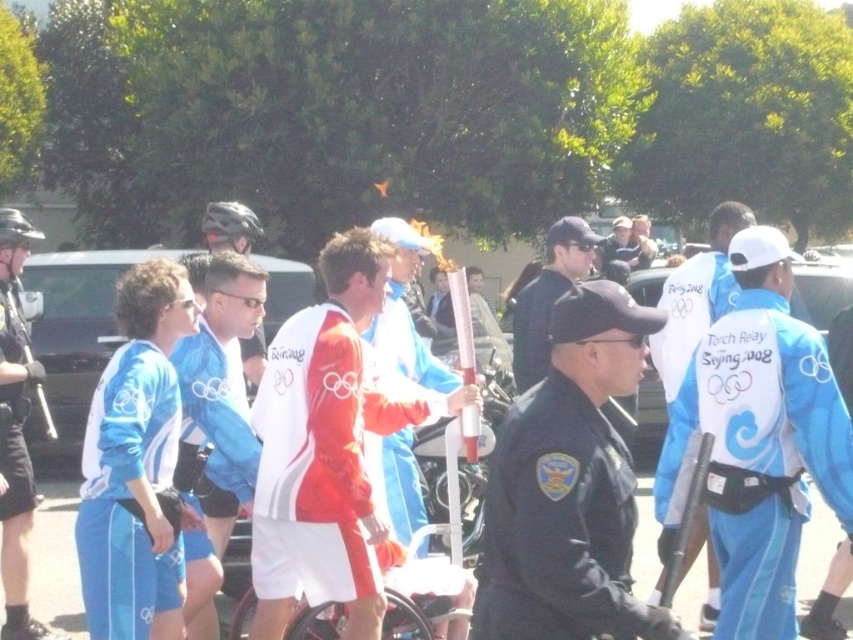
You are a photographer at the Olympic torch relay event. You need to capture a photo of both the blue fabric jacket at center and the dark blue uniform at center. Based on their positions, which one is located to the left side?

The blue fabric jacket at center is positioned on the left side of dark blue uniform at center, so the blue fabric jacket at center is located to the left side.

You are a photographer positioned at the center of the scene. You want to capture a photo that includes both the blue fabric jacket at left and the red jacket holding the lit torch. Based on their positions, which object is closer to your current position?

The blue fabric jacket at left is located closer to your position since it is at point 0.673 on the x and 0.020 on the y coordinate, which places it nearer to the center compared to the red jacket holding the lit torch.

You are an event organizer checking the layout of the torch relay route. You notice the blue fabric jacket at left and the light blue fabric jacket at center. Which jacket is positioned closer to the edge of the route?

The blue fabric jacket at left is wider than the light blue fabric jacket at center, so it is positioned closer to the edge of the route.